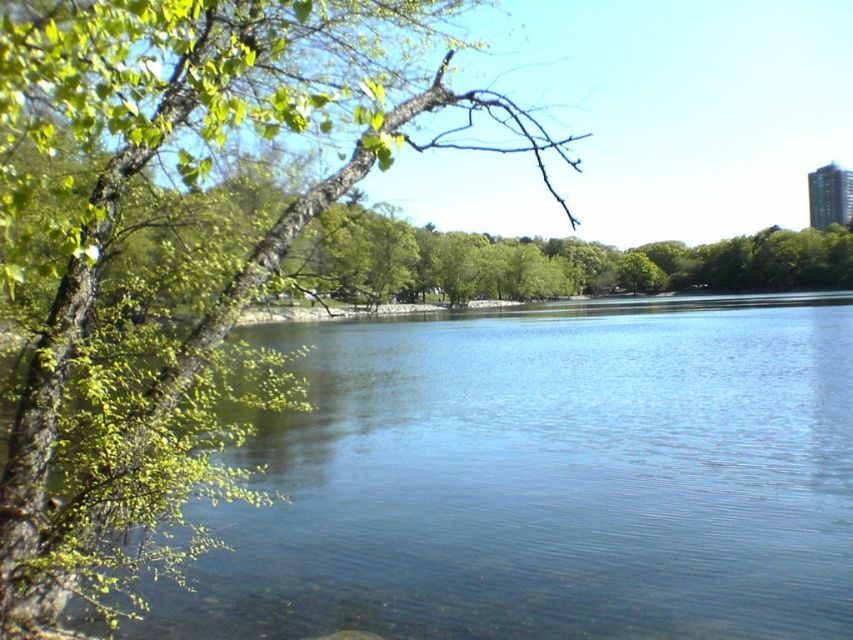
Is point (822, 365) farther from viewer compared to point (515, 112)?

Yes, point (822, 365) is behind point (515, 112).

Is clear blue water at left closer to camera compared to green leafy branch at left?

No, clear blue water at left is further to the viewer.

Does point (494, 317) come in front of point (79, 401)?

No, it is behind (79, 401).

Where is `clear blue water at left`? clear blue water at left is located at coordinates (546, 480).